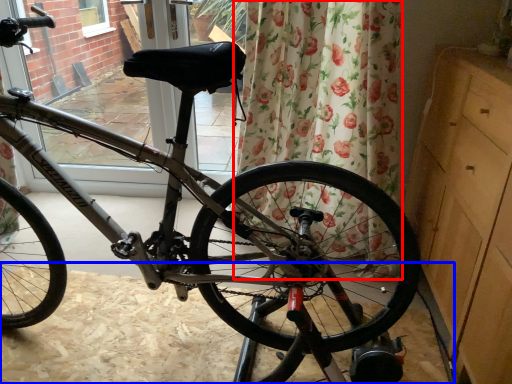
Question: Which point is closer to the camera, curtain (highlighted by a red box) or dirt track (highlighted by a blue box)?

Choices:
 (A) curtain
 (B) dirt track

Answer: (B)